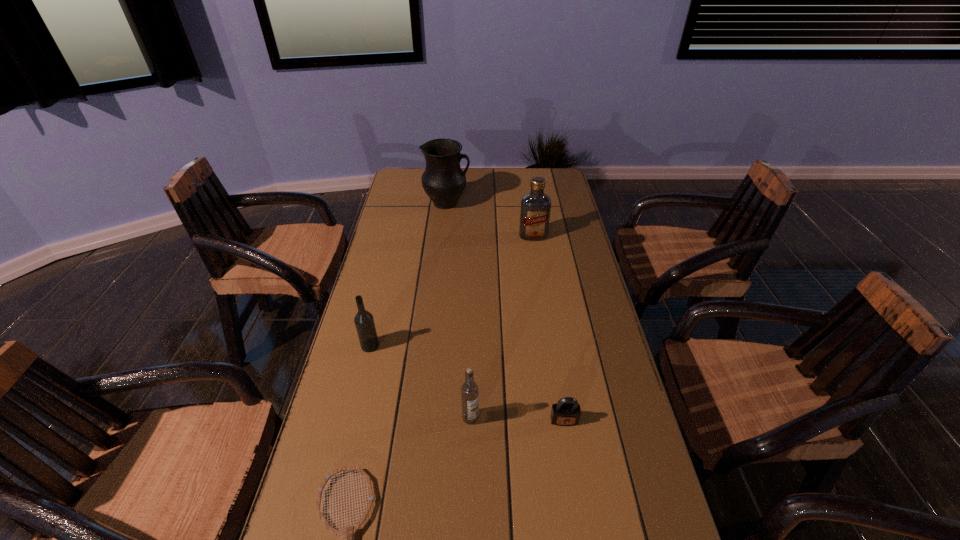
Identify the location of free spot located on the back of the fourth nearest object. (391, 260).

Find the location of a particular element. free location located on the front of the second shortest object near the keyhole is located at coordinates (569, 451).

Identify the location of object positioned at the far edge. Image resolution: width=960 pixels, height=540 pixels. (443, 180).

This screenshot has height=540, width=960. I want to click on pitcher positioned at the left edge, so click(x=443, y=180).

You are a GUI agent. You are given a task and a screenshot of the screen. Output one action in this format:
    pyautogui.click(x=<x>, y=<y>)
    Task: Click on the vodka that is at the left edge
    The image size is (960, 540).
    Given the screenshot: What is the action you would take?
    pyautogui.click(x=364, y=322)

Locate an element on the screen. The width and height of the screenshot is (960, 540). vodka that is positioned at the right edge is located at coordinates (535, 210).

Identify the location of padlock that is positioned at the right edge. (566, 412).

I want to click on object situated at the far left corner, so click(443, 180).

Identify the location of free region at the far edge. (489, 184).

This screenshot has width=960, height=540. In the image, there is a desktop. Find the location of `free region at the left edge`. free region at the left edge is located at coordinates (382, 236).